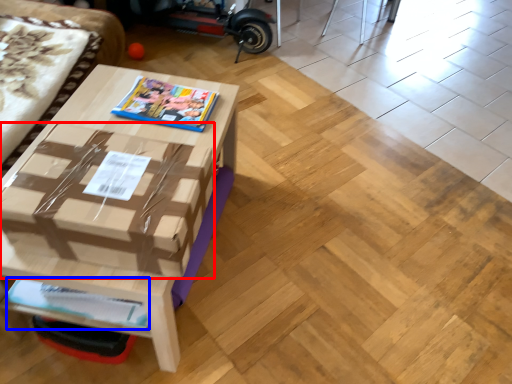
Question: Which object appears closest to the camera in this image, cardboard box (highlighted by a red box) or magazine (highlighted by a blue box)?

Choices:
 (A) cardboard box
 (B) magazine

Answer: (A)